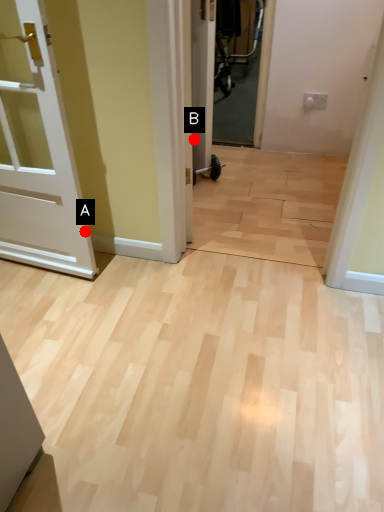
Question: Two points are circled on the image, labeled by A and B beside each circle. Among these points, which one is farthest from the camera?

Choices:
 (A) A is further
 (B) B is further

Answer: (B)